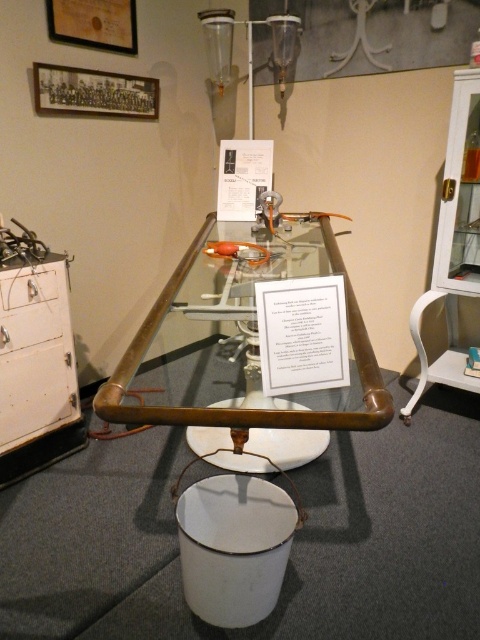
Question: Does white painted wood cabinet at left come in front of white matte drawer at left?

Choices:
 (A) no
 (B) yes

Answer: (B)

Question: Which object is positioned farthest from the white painted wood cabinet at left?

Choices:
 (A) white matte drawer at left
 (B) bronze polished table at center

Answer: (B)

Question: Is the position of bronze polished table at center less distant than that of white matte drawer at left?

Choices:
 (A) yes
 (B) no

Answer: (A)

Question: Which point is farther to the camera?

Choices:
 (A) (47, 390)
 (B) (36, 273)
 (C) (215, 452)

Answer: (A)

Question: Does bronze polished table at center have a greater width compared to white painted wood cabinet at left?

Choices:
 (A) yes
 (B) no

Answer: (A)

Question: Which of the following is the closest to the observer?

Choices:
 (A) white matte drawer at left
 (B) white painted wood cabinet at left

Answer: (B)